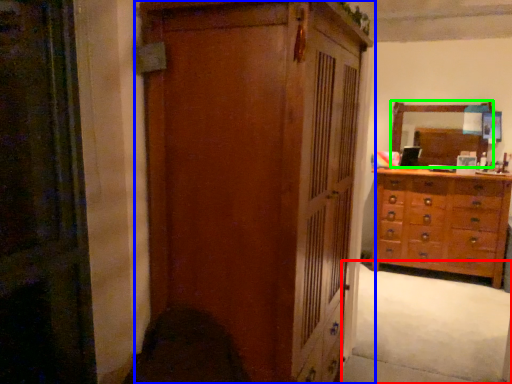
Question: Which object is positioned closest to plain (highlighted by a red box)? Select from cupboard (highlighted by a blue box) and mirror (highlighted by a green box).

Choices:
 (A) cupboard
 (B) mirror

Answer: (B)